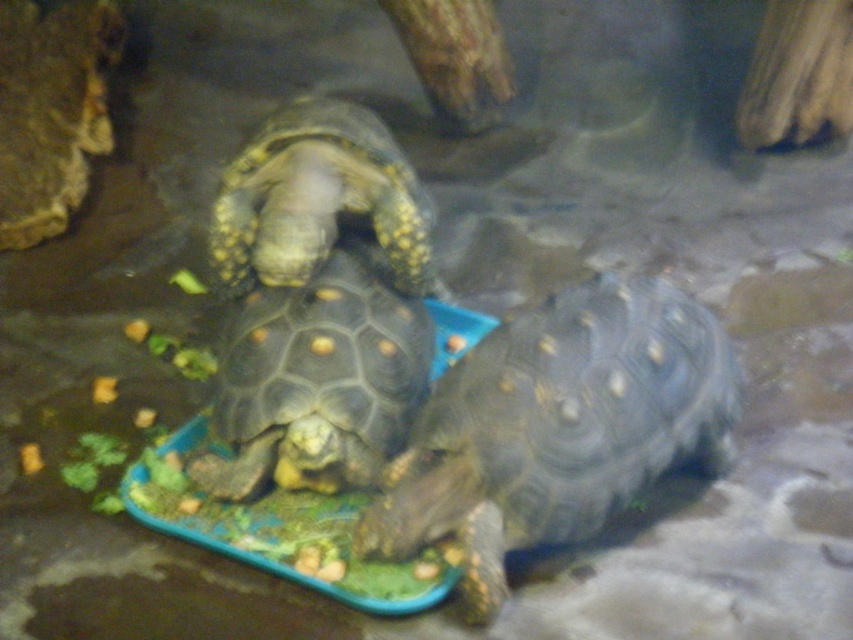
You are a caretaker trying to place a new feeding station in the enclosure. You have two points marked as potential locations for the station. The first point is at coordinates point (520, 468) and the second is at point (287, 412). Which point is closer to the tortoise that is currently reaching towards the blue tray with food?

The point at coordinates point (520, 468) is closer to the tortoise reaching towards the blue tray with food because it is closer to the viewer than point (287, 412).

You are a caretaker trying to place a new feeding dish in the enclosure. The dish must be positioned between the two points, point (672, 422) and point (419, 182). Since the dish needs to be closer to the tortoise that is farther from the camera, where should you place it?

The dish should be placed closer to point (419, 182) because it is farther from the camera than point (672, 422).